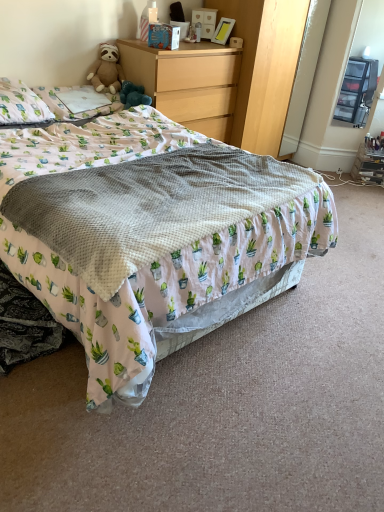
This screenshot has height=512, width=384. I want to click on soft brown teddy bear at upper left, so click(106, 70).

Measure the distance between point (1,115) and camera.

Point (1,115) is 2.41 meters away from camera.

This screenshot has height=512, width=384. What do you see at coordinates (77, 102) in the screenshot? I see `white cotton pillow at upper left, the 2th pillow when ordered from left to right` at bounding box center [77, 102].

Describe the element at coordinates (187, 84) in the screenshot. I see `wooden chest of drawers at upper center` at that location.

At what (x,y) coordinates should I click in order to perform the action: click on wooden chest of drawers at upper center. Please return your answer as a coordinate pair (x, y). The image size is (384, 512). Looking at the image, I should click on (187, 84).

Measure the distance between wooden dresser at upper center and camera.

The distance of wooden dresser at upper center from camera is 2.77 meters.

Describe the element at coordinates (228, 74) in the screenshot. The image size is (384, 512). I see `wooden dresser at upper center` at that location.

Locate an element on the screen. The height and width of the screenshot is (512, 384). soft brown teddy bear at upper left is located at coordinates point(106,70).

Considering the relative positions of white fabric pillow at upper left, which is counted as the 1th pillow, starting from the left, and soft brown teddy bear at upper left in the image provided, is white fabric pillow at upper left, which is counted as the 1th pillow, starting from the left, to the left of soft brown teddy bear at upper left from the viewer's perspective?

Correct, you'll find white fabric pillow at upper left, which is counted as the 1th pillow, starting from the left, to the left of soft brown teddy bear at upper left.

Is white fabric pillow at upper left, the 2th pillow when ordered from right to left, not close to soft brown teddy bear at upper left?

No.

How many degrees apart are the facing directions of white fabric pillow at upper left, which is counted as the 1th pillow, starting from the left, and soft brown teddy bear at upper left?

The facing directions of white fabric pillow at upper left, which is counted as the 1th pillow, starting from the left, and soft brown teddy bear at upper left are 36.6 degrees apart.

From the image's perspective, does white fabric pillow at upper left, the 2th pillow when ordered from right to left, appear lower than soft brown teddy bear at upper left?

Yes.

Is wooden dresser at upper center aimed at white fabric pillow at upper left, the 2th pillow when ordered from right to left?

No, wooden dresser at upper center is not facing towards white fabric pillow at upper left, the 2th pillow when ordered from right to left.

Does wooden dresser at upper center contain white fabric pillow at upper left, the 2th pillow when ordered from right to left?

No, wooden dresser at upper center does not contain white fabric pillow at upper left, the 2th pillow when ordered from right to left.

Which is in front, point (236, 57) or point (16, 81)?

The point (16, 81) is closer.

How distant is white printed blanket at center from wooden dresser at upper center?

white printed blanket at center and wooden dresser at upper center are 3.71 feet apart.

In the scene shown: Is white printed blanket at center not within wooden dresser at upper center?

white printed blanket at center lies outside wooden dresser at upper center's area.

Based on the photo, is white printed blanket at center thinner than wooden dresser at upper center?

No, white printed blanket at center is not thinner than wooden dresser at upper center.

Which object is closer to the camera, white printed blanket at center or wooden dresser at upper center?

white printed blanket at center is closer to the camera.

Is wooden dresser at upper center oriented away from white cotton pillow at upper left, the 1th pillow positioned from the right?

No, wooden dresser at upper center is not facing the opposite direction of white cotton pillow at upper left, the 1th pillow positioned from the right.

Is point (188, 85) closer or farther from the camera than point (70, 114)?

Point (188, 85) is positioned farther from the camera compared to point (70, 114).

How many degrees apart are the facing directions of wooden dresser at upper center and white cotton pillow at upper left, the 1th pillow positioned from the right?

0.596 degrees.

Between wooden dresser at upper center and white cotton pillow at upper left, the 2th pillow when ordered from left to right, which one has smaller size?

With smaller size is white cotton pillow at upper left, the 2th pillow when ordered from left to right.

Looking at this image, is white cotton pillow at upper left, the 1th pillow positioned from the right, oriented away from wooden dresser at upper center?

No, white cotton pillow at upper left, the 1th pillow positioned from the right,'s orientation is not away from wooden dresser at upper center.

Between white cotton pillow at upper left, the 1th pillow positioned from the right, and wooden dresser at upper center, which one appears on the right side from the viewer's perspective?

wooden dresser at upper center.

Do you think white fabric pillow at upper left, the 2th pillow when ordered from right to left, is within white printed blanket at center, or outside of it?

white fabric pillow at upper left, the 2th pillow when ordered from right to left, lies within the bounds of white printed blanket at center.

In the scene shown: Which object is more forward, white fabric pillow at upper left, the 2th pillow when ordered from right to left, or white printed blanket at center?

white printed blanket at center.

Is white fabric pillow at upper left, the 2th pillow when ordered from right to left, aimed at white printed blanket at center?

No, white fabric pillow at upper left, the 2th pillow when ordered from right to left, does not turn towards white printed blanket at center.

Is white fabric pillow at upper left, the 2th pillow when ordered from right to left, far away from white printed blanket at center?

No, white fabric pillow at upper left, the 2th pillow when ordered from right to left, is in close proximity to white printed blanket at center.

Who is taller, wooden chest of drawers at upper center or white cotton pillow at upper left, the 1th pillow positioned from the right?

wooden chest of drawers at upper center.

Between wooden chest of drawers at upper center and white cotton pillow at upper left, the 1th pillow positioned from the right, which one appears on the right side from the viewer's perspective?

wooden chest of drawers at upper center is more to the right.

Which object is thinner, wooden chest of drawers at upper center or white cotton pillow at upper left, the 2th pillow when ordered from left to right?

white cotton pillow at upper left, the 2th pillow when ordered from left to right.

In the scene shown: Is wooden chest of drawers at upper center not inside white cotton pillow at upper left, the 1th pillow positioned from the right?

Yes, wooden chest of drawers at upper center is not within white cotton pillow at upper left, the 1th pillow positioned from the right.

Find the location of a particular element. This screenshot has height=512, width=384. the 2nd pillow to the left of the soft brown teddy bear at upper left, starting your count from the anchor is located at coordinates (21, 104).

Locate an element on the screen. The width and height of the screenshot is (384, 512). pillow that appears above the wooden dresser at upper center (from a real-world perspective) is located at coordinates (21, 104).

Estimate the real-world distances between objects in this image. Which object is closer to wooden chest of drawers at upper center, soft brown teddy bear at upper left or white fabric pillow at upper left, the 2th pillow when ordered from right to left?

soft brown teddy bear at upper left is positioned closer to the anchor wooden chest of drawers at upper center.

Estimate the real-world distances between objects in this image. Which object is closer to soft brown teddy bear at upper left, white printed blanket at center or white fabric pillow at upper left, which is counted as the 1th pillow, starting from the left?

Among the two, white fabric pillow at upper left, which is counted as the 1th pillow, starting from the left, is located nearer to soft brown teddy bear at upper left.

Estimate the real-world distances between objects in this image. Which object is closer to white printed blanket at center, soft brown teddy bear at upper left or white cotton pillow at upper left, the 1th pillow positioned from the right?

white cotton pillow at upper left, the 1th pillow positioned from the right, lies closer to white printed blanket at center than the other object.

From the image, which object appears to be farther from wooden dresser at upper center, white fabric pillow at upper left, which is counted as the 1th pillow, starting from the left, or soft brown teddy bear at upper left?

white fabric pillow at upper left, which is counted as the 1th pillow, starting from the left, is positioned further to the anchor wooden dresser at upper center.

Considering their positions, is white fabric pillow at upper left, the 2th pillow when ordered from right to left, positioned further to white cotton pillow at upper left, the 2th pillow when ordered from left to right, than soft brown teddy bear at upper left?

soft brown teddy bear at upper left lies further to white cotton pillow at upper left, the 2th pillow when ordered from left to right, than the other object.

Estimate the real-world distances between objects in this image. Which object is closer to white printed blanket at center, white cotton pillow at upper left, the 1th pillow positioned from the right, or wooden chest of drawers at upper center?

The object closer to white printed blanket at center is white cotton pillow at upper left, the 1th pillow positioned from the right.

Based on their spatial positions, is white cotton pillow at upper left, the 2th pillow when ordered from left to right, or wooden dresser at upper center further from wooden chest of drawers at upper center?

white cotton pillow at upper left, the 2th pillow when ordered from left to right, lies further to wooden chest of drawers at upper center than the other object.

Based on their spatial positions, is white cotton pillow at upper left, the 2th pillow when ordered from left to right, or white fabric pillow at upper left, which is counted as the 1th pillow, starting from the left, closer to wooden chest of drawers at upper center?

white cotton pillow at upper left, the 2th pillow when ordered from left to right, lies closer to wooden chest of drawers at upper center than the other object.

Identify the location of teddy bear between white fabric pillow at upper left, the 2th pillow when ordered from right to left, and wooden dresser at upper center from left to right. This screenshot has height=512, width=384. (106, 70).

You are a GUI agent. You are given a task and a screenshot of the screen. Output one action in this format:
    pyautogui.click(x=<x>, y=<y>)
    Task: Click on the teddy bear between white cotton pillow at upper left, the 2th pillow when ordered from left to right, and wooden dresser at upper center, in the horizontal direction
    This screenshot has width=384, height=512.
    Given the screenshot: What is the action you would take?
    pyautogui.click(x=106, y=70)

Locate an element on the screen. pillow between white fabric pillow at upper left, which is counted as the 1th pillow, starting from the left, and wooden dresser at upper center, in the horizontal direction is located at coordinates (77, 102).

Locate an element on the screen. Image resolution: width=384 pixels, height=512 pixels. the chest of drawers located between white printed blanket at center and wooden dresser at upper center in the depth direction is located at coordinates (187, 84).